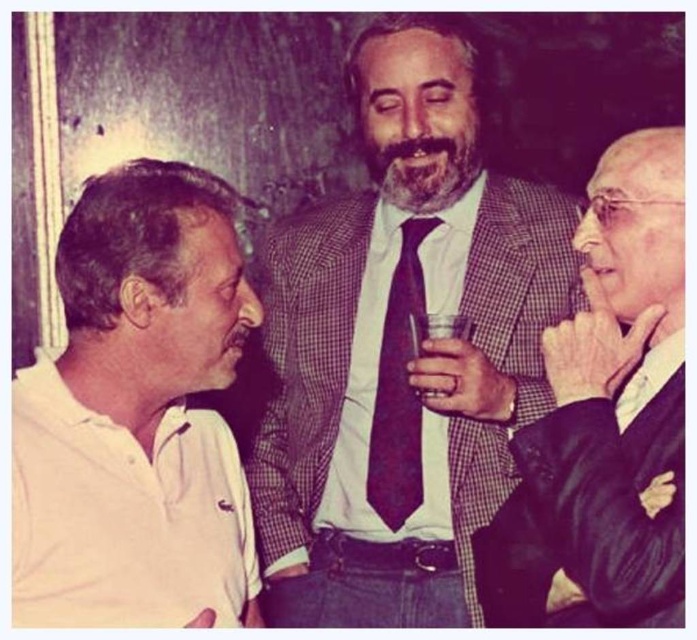
Is point (445, 180) positioned in front of point (427, 326)?

No.

Measure the distance between point (x=408, y=148) and camera.

They are 1.71 meters apart.

Does point (399, 150) lie in front of point (420, 326)?

No, (399, 150) is further to viewer.

Locate an element on the screen. beardsoft/hairyat center is located at coordinates (424, 166).

Is point (406, 38) farther from camera compared to point (572, 468)?

Yes, point (406, 38) is behind point (572, 468).

Is point (436, 45) positioned before point (659, 352)?

That is False.

Is point (542, 292) farther from camera compared to point (549, 592)?

Yes, point (542, 292) is behind point (549, 592).

Where is `checkered wool suit at center`? Image resolution: width=697 pixels, height=640 pixels. checkered wool suit at center is located at coordinates (401, 348).

Which is more to the left, black leather jacket at right or maroon silk tie at center?

From the viewer's perspective, maroon silk tie at center appears more on the left side.

Where is `black leather jacket at right`? black leather jacket at right is located at coordinates (605, 420).